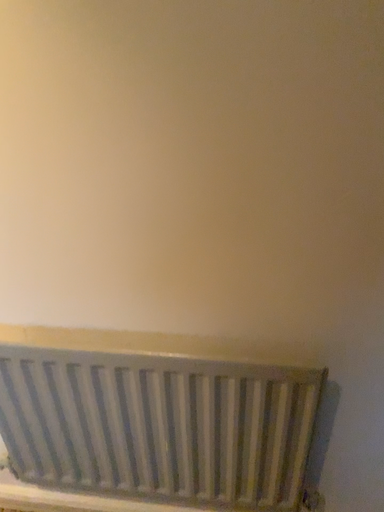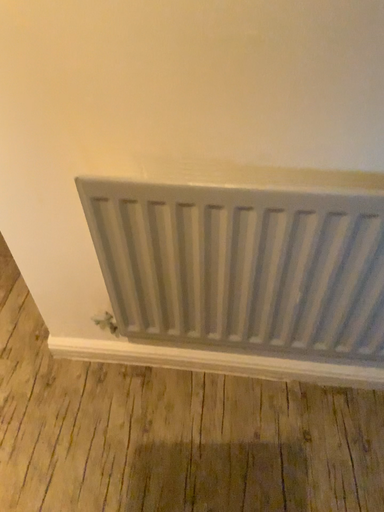
Question: How did the camera likely rotate when shooting the video?

Choices:
 (A) rotated upward
 (B) rotated downward

Answer: (B)